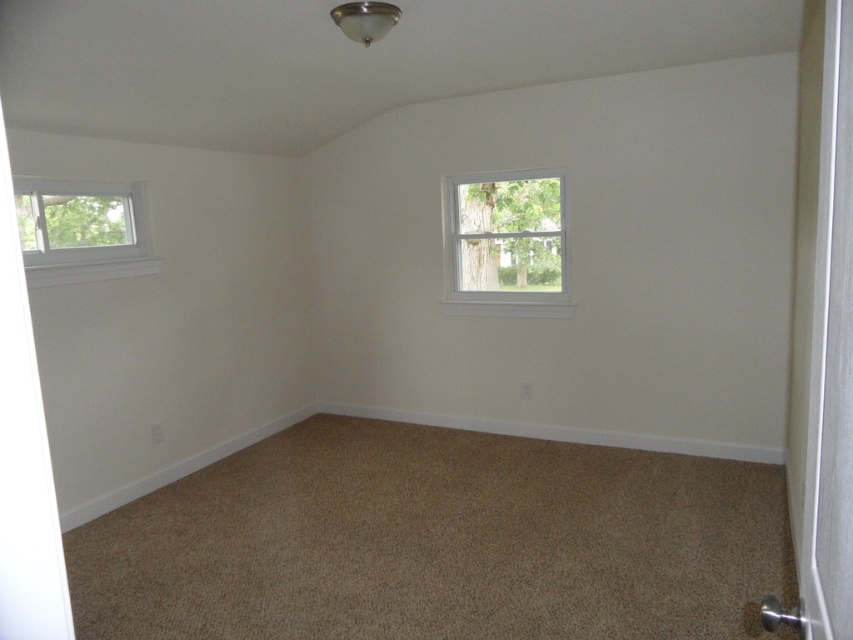
Question: Which point is farther from the camera taking this photo?

Choices:
 (A) (527, 216)
 (B) (67, 200)

Answer: (A)

Question: Which of the following is the farthest from the observer?

Choices:
 (A) clear glass window at upper left
 (B) white wooden window at upper center

Answer: (B)

Question: Is white wooden window at upper center thinner than clear glass window at upper left?

Choices:
 (A) yes
 (B) no

Answer: (A)

Question: Can you confirm if white wooden window at upper center is positioned to the right of clear glass window at upper left?

Choices:
 (A) no
 (B) yes

Answer: (B)

Question: From the image, what is the correct spatial relationship of white wooden window at upper center in relation to clear glass window at upper left?

Choices:
 (A) right
 (B) left

Answer: (A)